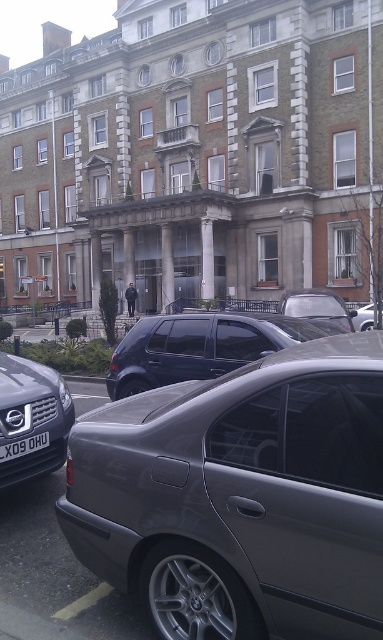
Which is behind, point (44, 396) or point (297, 316)?

Positioned behind is point (297, 316).

Who is positioned more to the left, matte black car at left or metallic silver car at center?

matte black car at left is more to the left.

Locate an element on the screen. Image resolution: width=383 pixels, height=640 pixels. matte black car at left is located at coordinates (32, 419).

You are a GUI agent. You are given a task and a screenshot of the screen. Output one action in this format:
    pyautogui.click(x=<x>, y=<y>)
    Task: Click on the matte black car at left
    
    Given the screenshot: What is the action you would take?
    pyautogui.click(x=32, y=419)

Does metallic gray sedan at center come in front of silver metallic car at center?

Yes.

Does metallic gray sedan at center appear over silver metallic car at center?

No.

Which is in front, point (291, 509) or point (361, 314)?

Point (291, 509)

Find the location of a particular element. metallic gray sedan at center is located at coordinates (240, 497).

Does metallic blue minivan at center have a smaller size compared to matte black car at left?

Actually, metallic blue minivan at center might be larger than matte black car at left.

Can you confirm if metallic blue minivan at center is shorter than matte black car at left?

Incorrect, metallic blue minivan at center's height does not fall short of matte black car at left's.

Does point (160, 355) come farther from viewer compared to point (68, 401)?

Yes, it is.

I want to click on metallic blue minivan at center, so click(x=199, y=346).